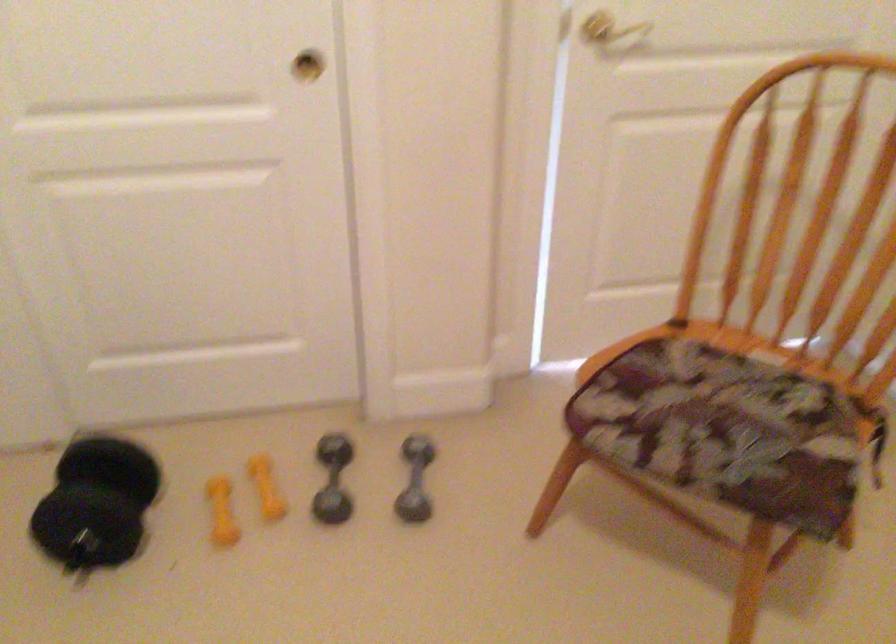
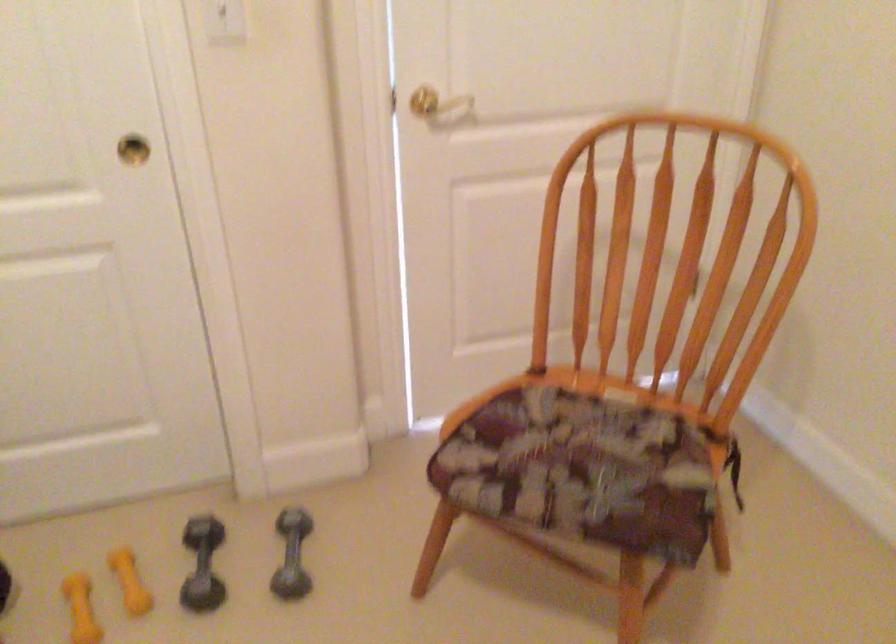
Find the pixel in the second image that matches the point at 721,430 in the first image.

(582, 469)